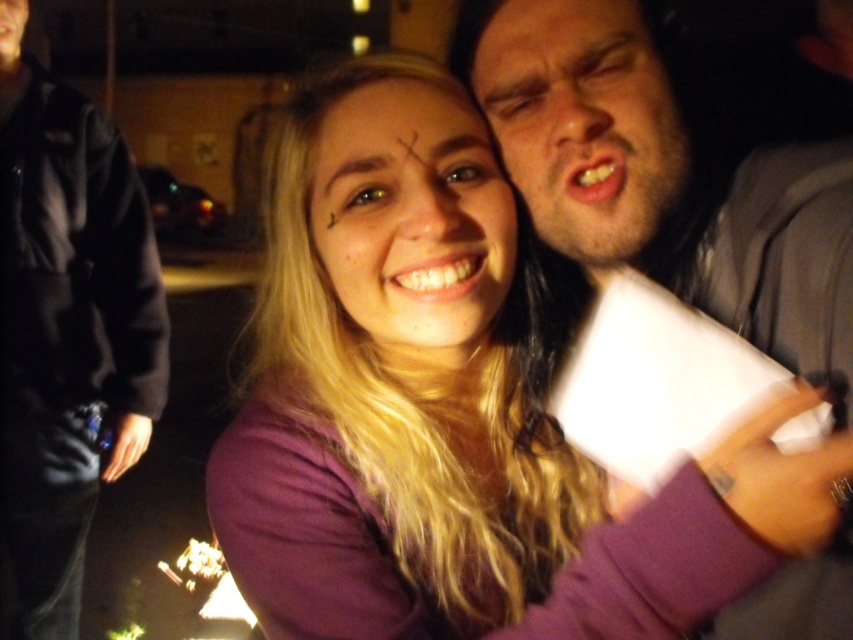
You are trying to locate the black fleece jacket at center in the image. According to the coordinates provided, where exactly would you find it?

The black fleece jacket at center is located at point coordinates of (67,326).

You are a photographer trying to capture a clear shot of both the black fleece jacket at center and the matte skin face at center in the nighttime scene. Given their positions, which object should you focus on first to ensure both are in focus?

The black fleece jacket at center is much taller than the matte skin face at center, so focusing on the black fleece jacket at center first will help ensure both are in focus since it is closer to the camera.